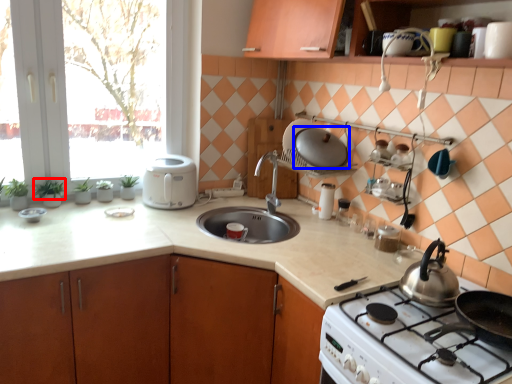
Question: Which point is closer to the camera, plant (highlighted by a red box) or kitchen appliance (highlighted by a blue box)?

Choices:
 (A) plant
 (B) kitchen appliance

Answer: (B)